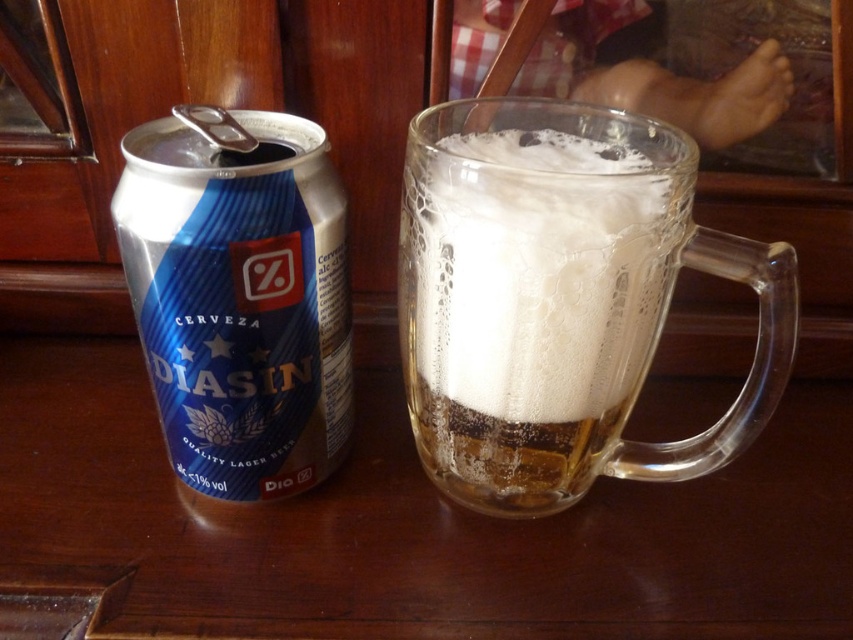
You are a bartender who needs to serve a drink. You have a clear glass mug at center and a white frothy foam at upper center. Which object should you use to pour the beer into a customer glass?

The clear glass mug at center should be used to pour the beer into a customer glass because it is larger in size than the white frothy foam at upper center, which is just the foam on top of the beer.

You are a bartender who needs to determine if the white frothy foam at upper center can fit entirely into the clear glass mug at center without spilling. Based on their widths, can you confirm if this is possible?

The clear glass mug at center is wider than the white frothy foam at upper center, so yes, the foam can fit entirely into the clear glass mug at center without spilling.

You are at a bar and want to pour the remaining beer from the blue metallic can at left into the white frothy foam at upper center. Can you do this without spilling?

The blue metallic can at left is larger in size than the white frothy foam at upper center, so pouring the remaining beer from the blue metallic can at left into the white frothy foam at upper center may cause overflow and spilling.